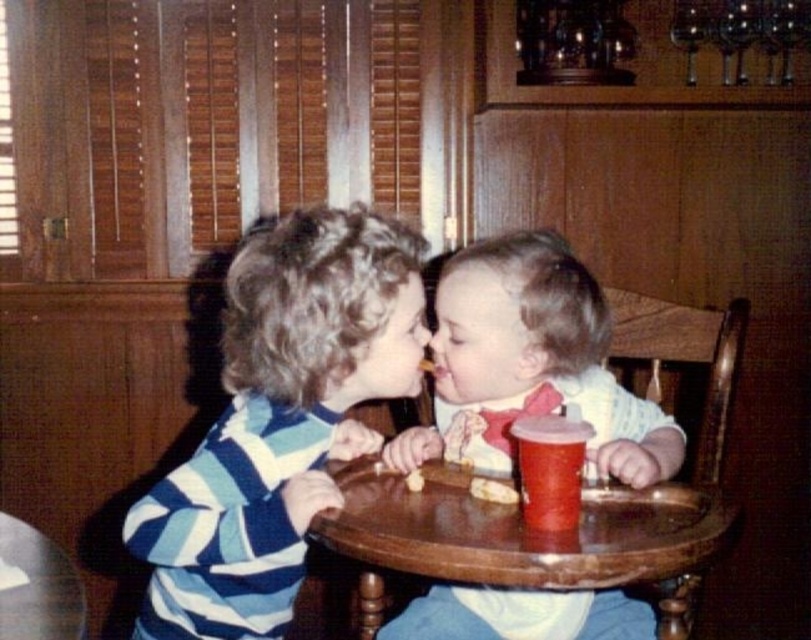
Question: Is white cotton bib at center wider than smooth yellow cracker at center?

Choices:
 (A) yes
 (B) no

Answer: (A)

Question: Can you confirm if white cotton bib at center is wider than matte plastic cup at center?

Choices:
 (A) yes
 (B) no

Answer: (A)

Question: Can you confirm if wooden tray at center is wider than matte plastic cup at center?

Choices:
 (A) yes
 (B) no

Answer: (A)

Question: Among these points, which one is farthest from the camera?

Choices:
 (A) (331, 387)
 (B) (547, 438)
 (C) (470, 492)
 (D) (477, 538)

Answer: (A)

Question: Estimate the real-world distances between objects in this image. Which object is closer to the white cotton bib at center?

Choices:
 (A) wooden tray at center
 (B) striped cotton shirt at left

Answer: (A)

Question: Which is farther from the matte plastic cup at center?

Choices:
 (A) wooden tray at center
 (B) golden crumbly biscuit at center

Answer: (A)